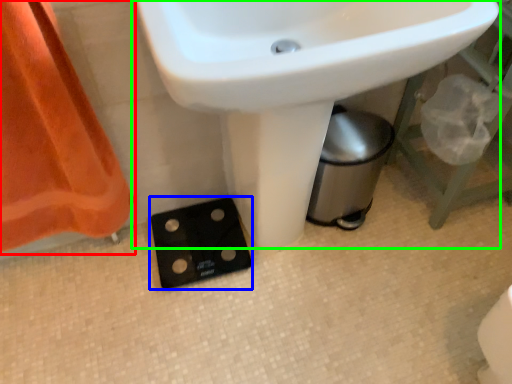
Question: Based on their relative distances, which object is farther from curtain (highlighted by a red box)? Choose from socket (highlighted by a blue box) and sink (highlighted by a green box).

Choices:
 (A) socket
 (B) sink

Answer: (B)